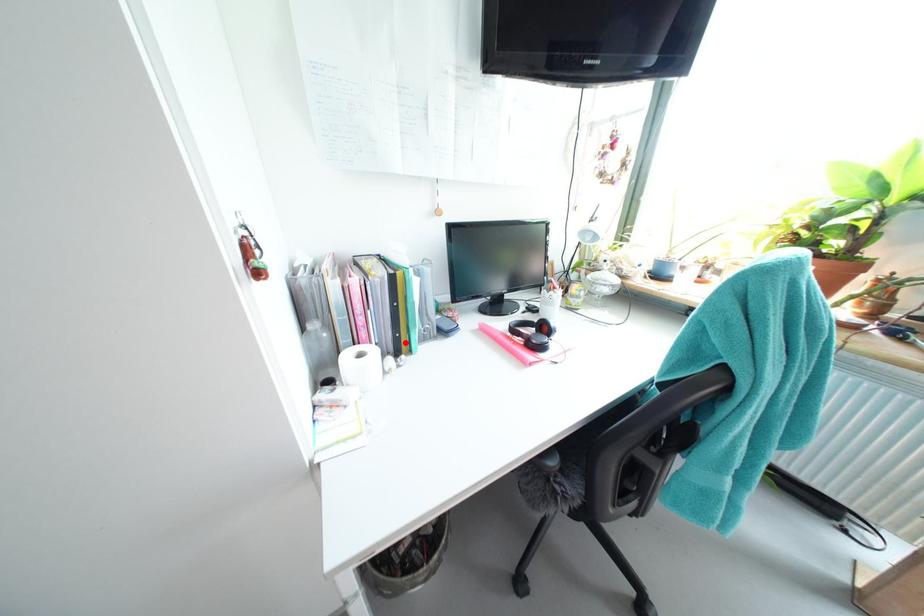
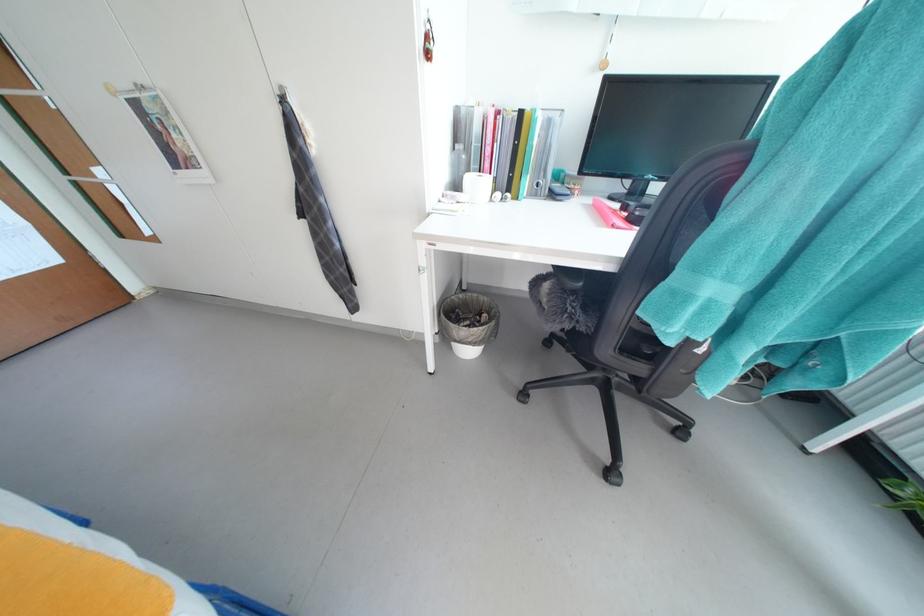
Question: A red point is marked in image1. In image2, is the corresponding 3D point closer to the camera or farther? Reply with the corresponding letter.

Choices:
 (A) The corresponding 3D point is closer.
 (B) The corresponding 3D point is farther.

Answer: (A)